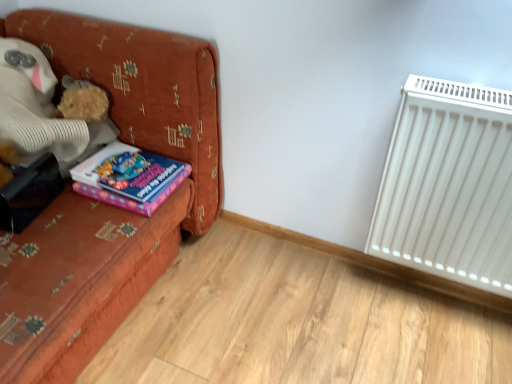
In order to click on vacant area on top of purple matte book at left (from a real-world perspective) in this screenshot , I will do `click(126, 161)`.